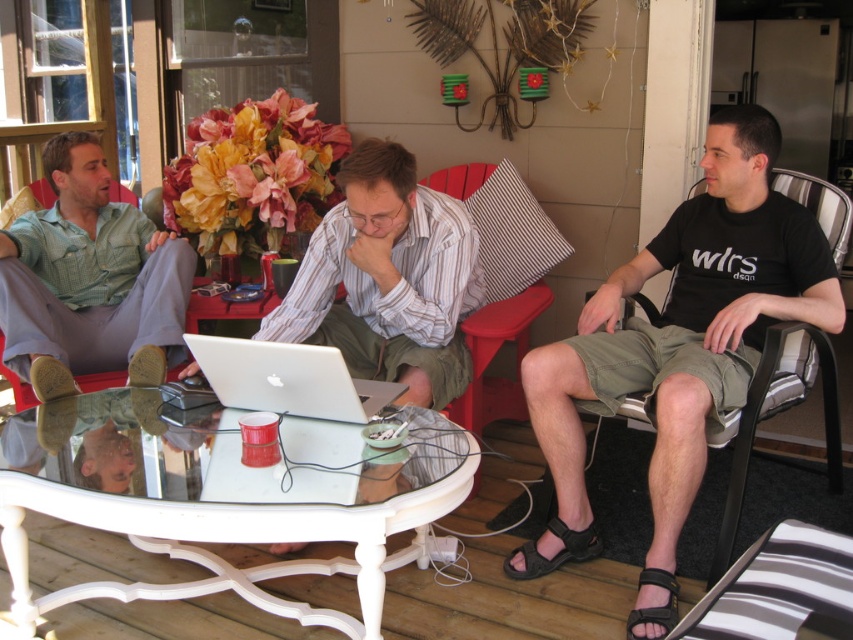
Question: Which point is farther to the camera?

Choices:
 (A) silver metallic laptop at center
 (B) green checkered shirt at left
 (C) white glossy table at center
 (D) black leather sandal at lower right

Answer: (B)

Question: Considering the real-world distances, which object is closest to the silver metallic laptop at center?

Choices:
 (A) white glossy table at center
 (B) red plastic chair at center
 (C) black leather sandal at lower right

Answer: (A)

Question: Is green checkered shirt at left to the right of black fabric sandal at lower right from the viewer's perspective?

Choices:
 (A) no
 (B) yes

Answer: (A)

Question: Is white glossy table at center wider than black leather sandal at lower right?

Choices:
 (A) no
 (B) yes

Answer: (B)

Question: Which object is the closest to the green checkered shirt at left?

Choices:
 (A) red plastic chair at center
 (B) black leather sandal at lower right

Answer: (A)

Question: Is silver metallic laptop at center to the right of red plastic chair at center from the viewer's perspective?

Choices:
 (A) yes
 (B) no

Answer: (B)